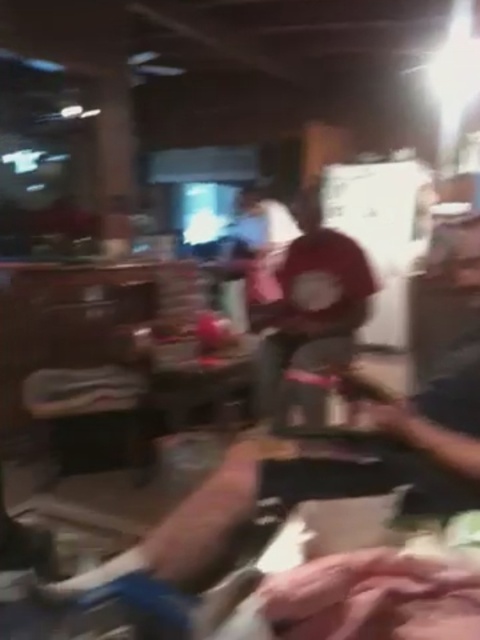
You are a delivery person who needs to place a package between the red cotton shirt at center and the dark blue shirt at right. The package is 3 feet wide. Can you fit it between them?

The red cotton shirt at center and dark blue shirt at right are 5.51 feet apart from each other. Since the package is 3 feet wide, there is enough space between them to fit the package.

You are a customer in a store and you see the red cotton shirt at center and the dark blue shirt at right. Which shirt is higher up in the display?

The red cotton shirt at center is higher up than the dark blue shirt at right because it is located above it.

You are organizing a clothing store and need to arrange the red cotton shirt at center and the dark blue shirt at right on a rack. Based on their sizes, which shirt should be placed higher on the rack?

The red cotton shirt at center is larger than the dark blue shirt at right, so it should be placed higher on the rack to accommodate its size.